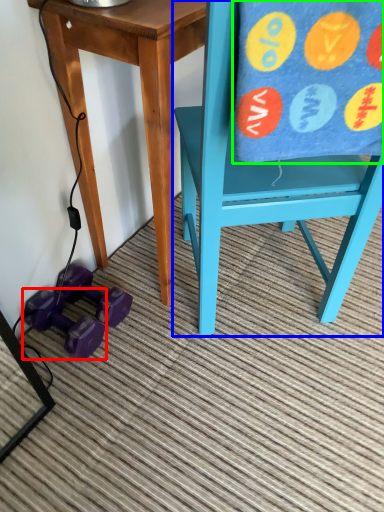
Question: Estimate the real-world distances between objects in this image. Which object is closer to dumbbell (highlighted by a red box), chair (highlighted by a blue box) or beach towel (highlighted by a green box)?

Choices:
 (A) chair
 (B) beach towel

Answer: (A)